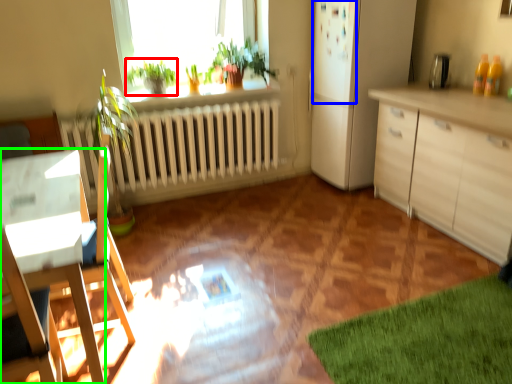
Question: Estimate the real-world distances between objects in this image. Which object is farther from plant (highlighted by a red box), screen door (highlighted by a blue box) or desk (highlighted by a green box)?

Choices:
 (A) screen door
 (B) desk

Answer: (B)